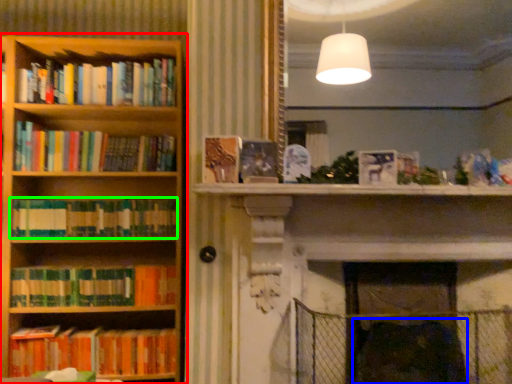
Question: Which is farther away from bookcase (highlighted by a red box)? swivel chair (highlighted by a blue box) or book (highlighted by a green box)?

Choices:
 (A) swivel chair
 (B) book

Answer: (A)